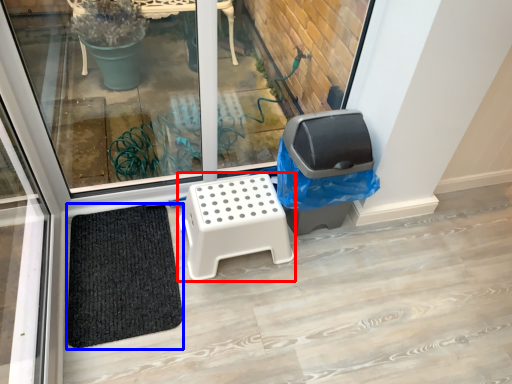
Question: Which object appears farthest to the camera in this image, furniture (highlighted by a red box) or doormat (highlighted by a blue box)?

Choices:
 (A) furniture
 (B) doormat

Answer: (A)